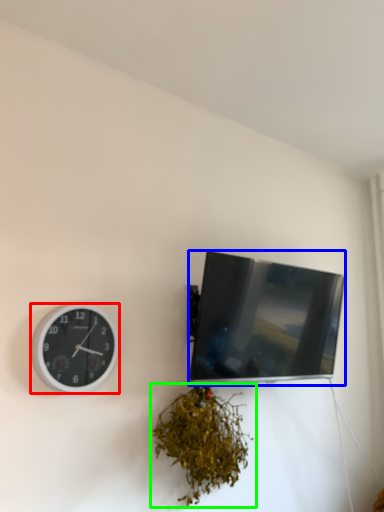
Question: Which is nearer to the wall clock (highlighted by a red box)? television (highlighted by a blue box) or houseplant (highlighted by a green box).

Choices:
 (A) television
 (B) houseplant

Answer: (B)